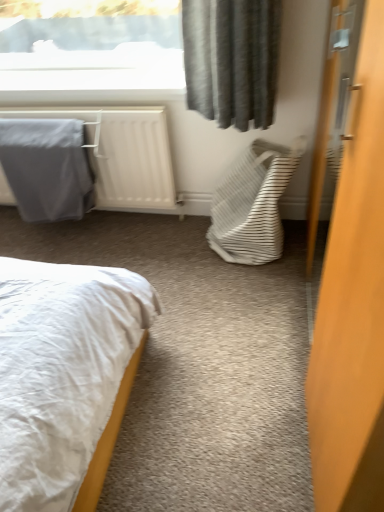
I want to click on vacant space in between wooden door at right and white striped fabric laundry basket at center-right, so click(x=252, y=337).